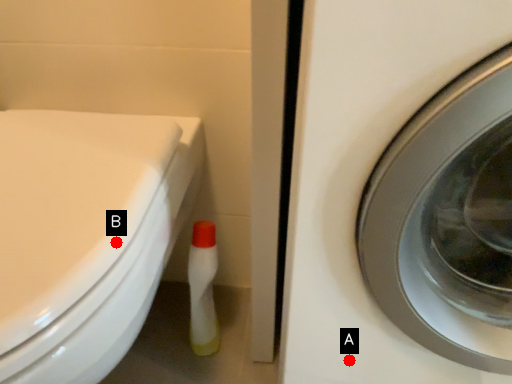
Question: Two points are circled on the image, labeled by A and B beside each circle. Which point is further to the camera?

Choices:
 (A) A is further
 (B) B is further

Answer: (A)